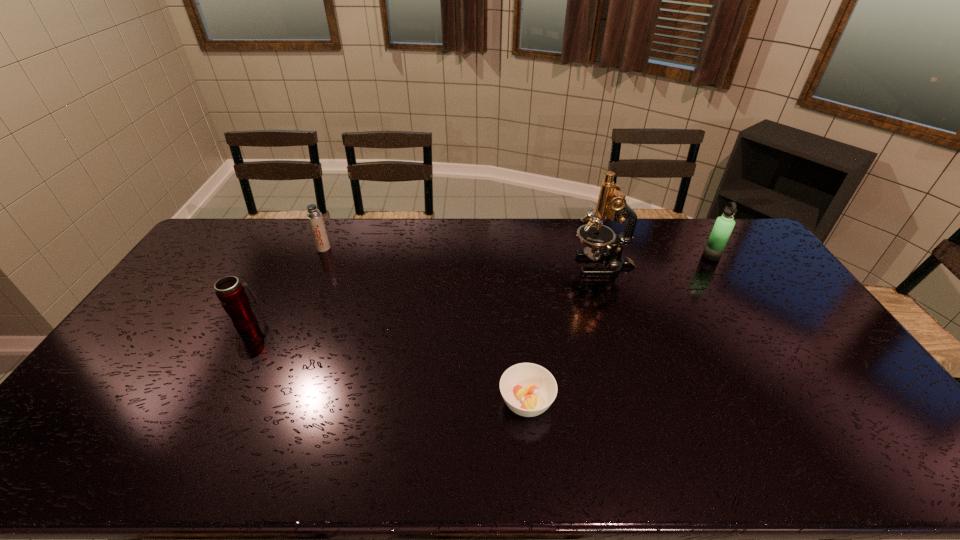
Image resolution: width=960 pixels, height=540 pixels. What are the coordinates of `vacant point located between the shortest object and the fourth farthest object` in the screenshot? It's located at (387, 362).

Where is `blank region between the second nearest object and the tallest object`? blank region between the second nearest object and the tallest object is located at coordinates (425, 294).

Image resolution: width=960 pixels, height=540 pixels. Find the location of `empty space that is in between the third object from right to left and the nearest thermos bottle`. empty space that is in between the third object from right to left and the nearest thermos bottle is located at coordinates (387, 362).

Where is `vacant area that lies between the rightmost thermos bottle and the second thermos bottle from left to right`? The width and height of the screenshot is (960, 540). vacant area that lies between the rightmost thermos bottle and the second thermos bottle from left to right is located at coordinates (517, 252).

This screenshot has height=540, width=960. I want to click on free space between the microscope and the second thermos bottle from right to left, so click(463, 256).

This screenshot has height=540, width=960. Identify the location of free space between the tallest thermos bottle and the microscope. (657, 260).

Identify the location of object that stands as the second closest to the second thermos bottle from right to left. (528, 389).

Where is `object that is the fourth closest to the fourth object from right to left`? This screenshot has height=540, width=960. object that is the fourth closest to the fourth object from right to left is located at coordinates (722, 229).

Point out which thermos bottle is positioned as the third nearest to the soup bowl. Please provide its 2D coordinates. Your answer should be formatted as a tuple, i.e. [(x, y)], where the tuple contains the x and y coordinates of a point satisfying the conditions above.

[(315, 220)]

Identify which thermos bottle is the second closest to the rightmost object. Please provide its 2D coordinates. Your answer should be formatted as a tuple, i.e. [(x, y)], where the tuple contains the x and y coordinates of a point satisfying the conditions above.

[(229, 290)]